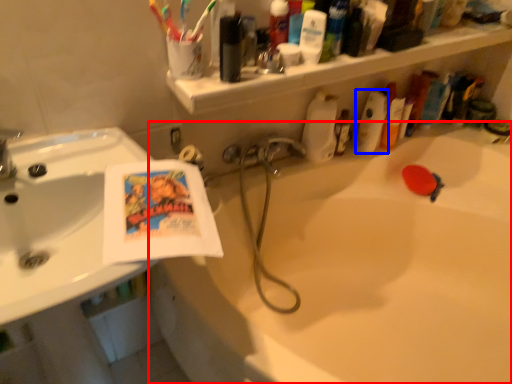
Question: Which of the following is the farthest to the observer, bathtub (highlighted by a red box) or cleaning product (highlighted by a blue box)?

Choices:
 (A) bathtub
 (B) cleaning product

Answer: (B)